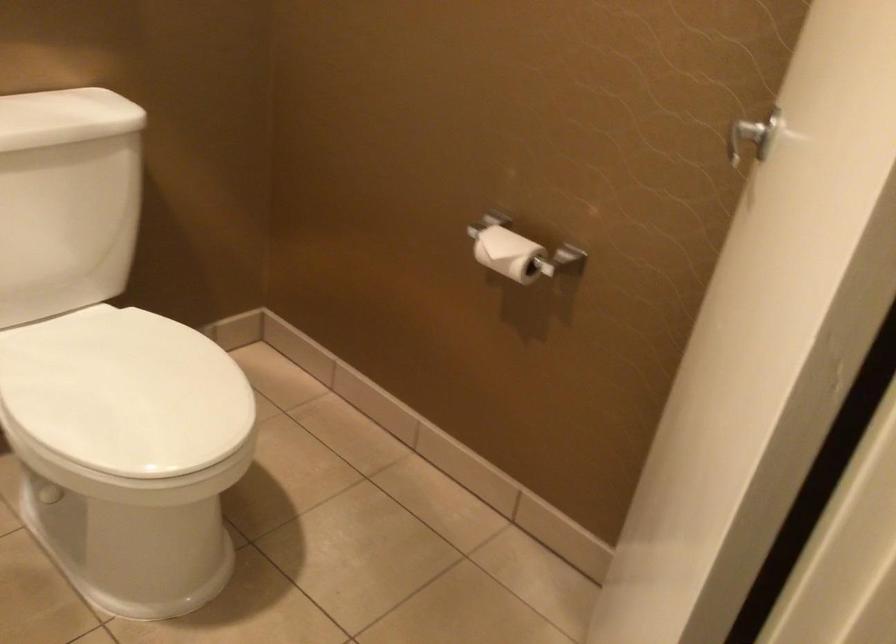
What do you see at coordinates (125, 393) in the screenshot? I see `a white toilet lid` at bounding box center [125, 393].